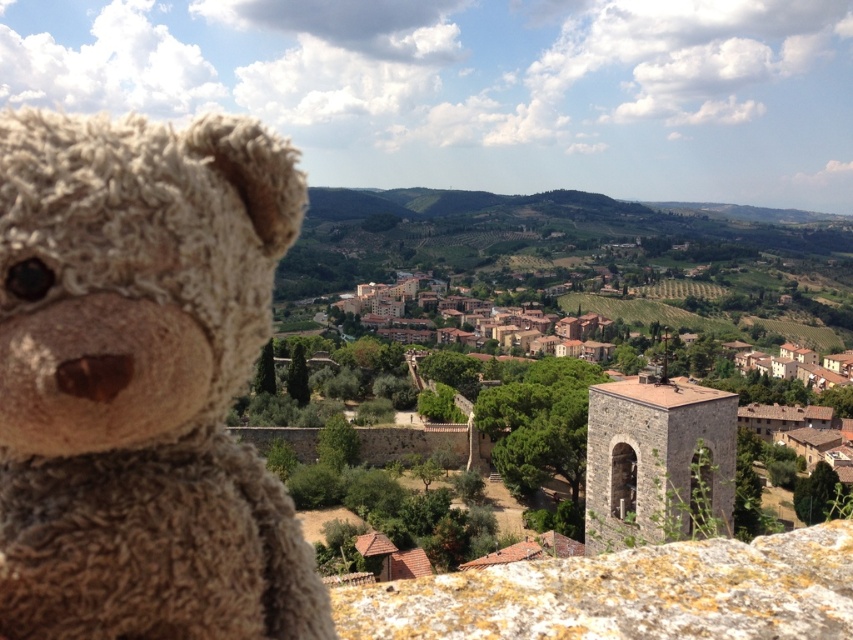
You are a photographer standing in the valley and want to take a photo of the town while including the fuzzy beige teddy bear at left in the frame. Based on its position, where should you position yourself to ensure the teddy bear at left is visible in the shot?

The fuzzy beige teddy bear at left is located at point (141, 381), which is in the lower left quadrant of the image. To include it in the photo while capturing the town, you should position yourself to the left side of the scene so that the teddy bear at left remains within the frame.

You are a photographer trying to capture a photo of the rusty stone wall at lower center while keeping the fuzzy beige teddy bear at left in the background. Given that your camera has a depth of field that can focus on objects within a 10 meter range, will the teddy bear appear blurry in the photo?

The fuzzy beige teddy bear at left and the rusty stone wall at lower center are 11.87 meters apart. Since the depth of field can only focus on objects within 10 meters, the teddy bear will appear blurry in the photo.

You are a photographer trying to capture the entire scene of the town and the stone wall in one shot. Given that the fuzzy beige teddy bear at left is smaller than the rusty stone wall at lower center, would you need to adjust your camera position to ensure both are fully visible?

The fuzzy beige teddy bear at left is narrower than the rusty stone wall at lower center. Since the teddy bear is smaller in width, it should fit within the frame if the stone wall is already captured. However, ensure the camera angle includes both the teddy bear on the left and the stone wall at the lower center to fully capture the scene.